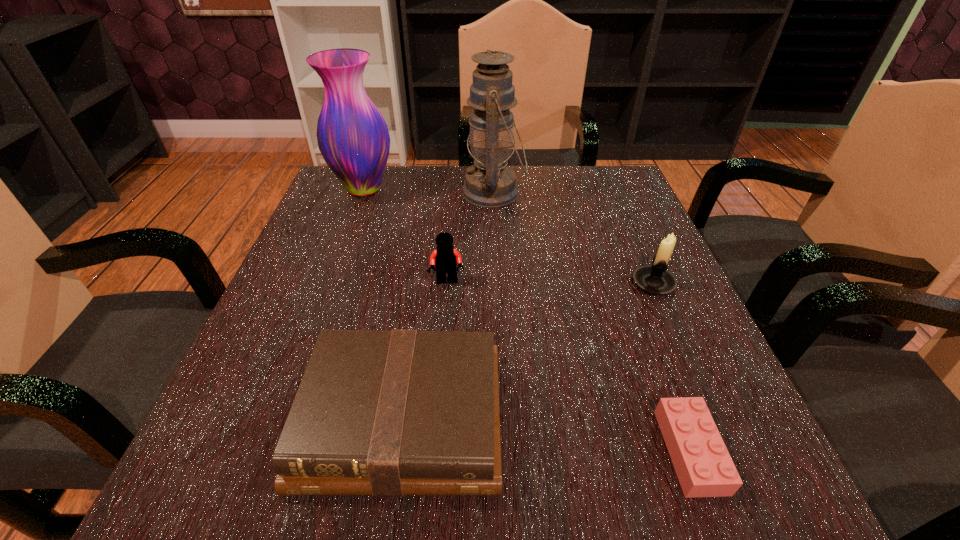
This screenshot has width=960, height=540. I want to click on Lego present at the right edge, so click(703, 465).

Where is `object that is at the far left corner`? The width and height of the screenshot is (960, 540). object that is at the far left corner is located at coordinates (353, 138).

Where is `object that is positioned at the near left corner`? The width and height of the screenshot is (960, 540). object that is positioned at the near left corner is located at coordinates (388, 413).

The width and height of the screenshot is (960, 540). Find the location of `object that is at the near right corner`. object that is at the near right corner is located at coordinates (703, 465).

Where is `blank space at the far edge`? Image resolution: width=960 pixels, height=540 pixels. blank space at the far edge is located at coordinates (418, 197).

In the image, there is a desktop. Where is `vacant space at the near edge`? The height and width of the screenshot is (540, 960). vacant space at the near edge is located at coordinates (597, 445).

Where is `vacant region at the left edge of the desktop`? The width and height of the screenshot is (960, 540). vacant region at the left edge of the desktop is located at coordinates (317, 244).

The height and width of the screenshot is (540, 960). What are the coordinates of `vacant region at the right edge of the desktop` in the screenshot? It's located at (589, 226).

You are a GUI agent. You are given a task and a screenshot of the screen. Output one action in this format:
    pyautogui.click(x=<x>, y=<y>)
    Task: Click on the vacant position at the far left corner of the desktop
    The height and width of the screenshot is (540, 960).
    Given the screenshot: What is the action you would take?
    pyautogui.click(x=372, y=211)

Locate an element on the screen. The height and width of the screenshot is (540, 960). vacant region at the far right corner is located at coordinates (610, 166).